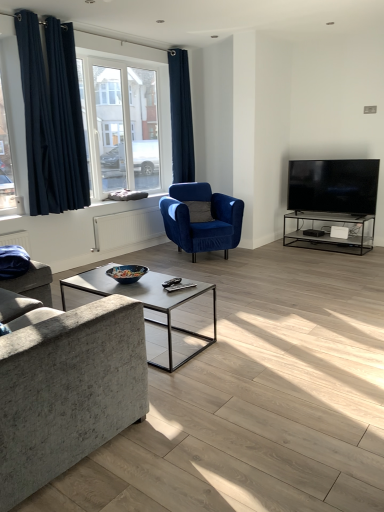
Question: Which direction should I rotate to look at dark blue velvet curtain at upper center, the second curtain from the front, — up or down?

Choices:
 (A) up
 (B) down

Answer: (A)

Question: Is velvet blue armchair at center turned away from dark blue velvet curtains at left, which appears as the first curtain when viewed from the left?

Choices:
 (A) yes
 (B) no

Answer: (B)

Question: Is velvet blue armchair at center wider than dark blue velvet curtains at left, the 1th curtain in the front-to-back sequence?

Choices:
 (A) no
 (B) yes

Answer: (B)

Question: Is dark blue velvet curtains at left, the 2th curtain positioned from the right, surrounded by velvet blue armchair at center?

Choices:
 (A) no
 (B) yes

Answer: (A)

Question: From the image's perspective, is velvet blue armchair at center beneath dark blue velvet curtains at left, which appears as the first curtain when viewed from the left?

Choices:
 (A) no
 (B) yes

Answer: (B)

Question: From a real-world perspective, is velvet blue armchair at center beneath dark blue velvet curtains at left, which appears as the first curtain when viewed from the left?

Choices:
 (A) yes
 (B) no

Answer: (A)

Question: Is velvet blue armchair at center at the right side of dark blue velvet curtains at left, which is the 2th curtain in back-to-front order?

Choices:
 (A) yes
 (B) no

Answer: (A)

Question: Is dark blue velvet curtain at upper center, arranged as the first curtain when viewed from the right, bigger than velvet blue armchair at center?

Choices:
 (A) no
 (B) yes

Answer: (A)

Question: Does dark blue velvet curtain at upper center, the second curtain from the front, have a smaller size compared to velvet blue armchair at center?

Choices:
 (A) no
 (B) yes

Answer: (B)

Question: Is dark blue velvet curtain at upper center, the second curtain from the front, outside of velvet blue armchair at center?

Choices:
 (A) yes
 (B) no

Answer: (A)

Question: Can you see dark blue velvet curtain at upper center, arranged as the first curtain when viewed from the right, touching velvet blue armchair at center?

Choices:
 (A) yes
 (B) no

Answer: (B)

Question: From a real-world perspective, is dark blue velvet curtain at upper center, the 2th curtain viewed from the left, beneath velvet blue armchair at center?

Choices:
 (A) yes
 (B) no

Answer: (B)

Question: Is dark blue velvet curtain at upper center, the 2th curtain viewed from the left, thinner than velvet blue armchair at center?

Choices:
 (A) yes
 (B) no

Answer: (A)

Question: Is clear glass window at upper left wider than textured gray fabric couch at left?

Choices:
 (A) yes
 (B) no

Answer: (B)